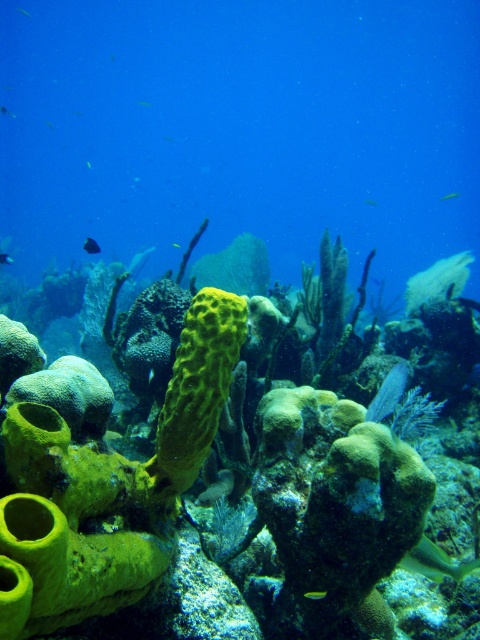
Question: Does green matte fish at upper right have a smaller size compared to translucent yellow fish at upper left?

Choices:
 (A) no
 (B) yes

Answer: (A)

Question: Is green textured sponge at center thinner than green matte fish at upper center?

Choices:
 (A) yes
 (B) no

Answer: (B)

Question: Does shiny blue fish at center have a greater width compared to green matte fish at upper right?

Choices:
 (A) yes
 (B) no

Answer: (B)

Question: Which object appears closest to the camera in this image?

Choices:
 (A) blue glossy fish at center
 (B) green textured sponge at center
 (C) translucent yellow fish at upper left

Answer: (B)

Question: Which point is farther to the camera?

Choices:
 (A) translucent yellow fish at center
 (B) green matte fish at upper center
 (C) shiny blue fish at upper left

Answer: (A)

Question: Considering the real-world distances, which object is closest to the translucent yellow fish at upper left?

Choices:
 (A) translucent green fish at lower right
 (B) shiny yellow-green fish at center
 (C) green matte fish at upper center
 (D) shiny blue fish at upper left

Answer: (C)